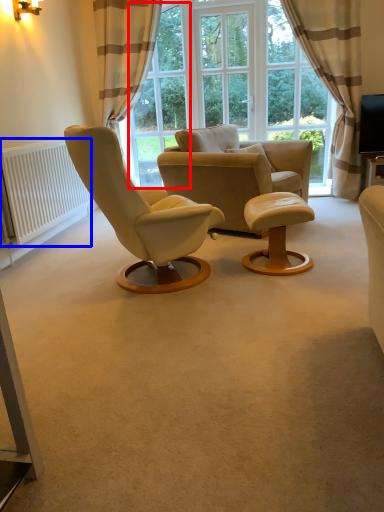
Question: Which point is closer to the camera, window screen (highlighted by a red box) or radiator (highlighted by a blue box)?

Choices:
 (A) window screen
 (B) radiator

Answer: (B)